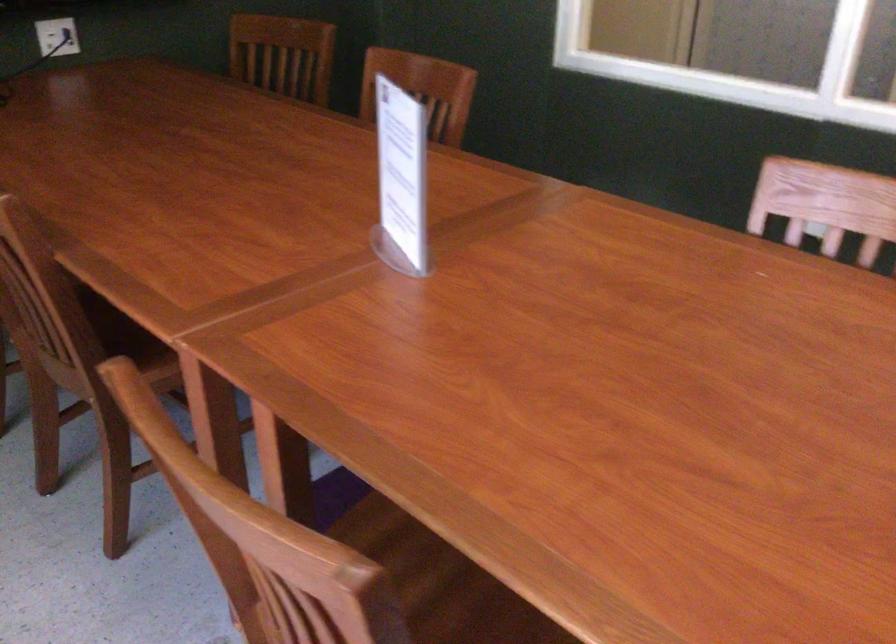
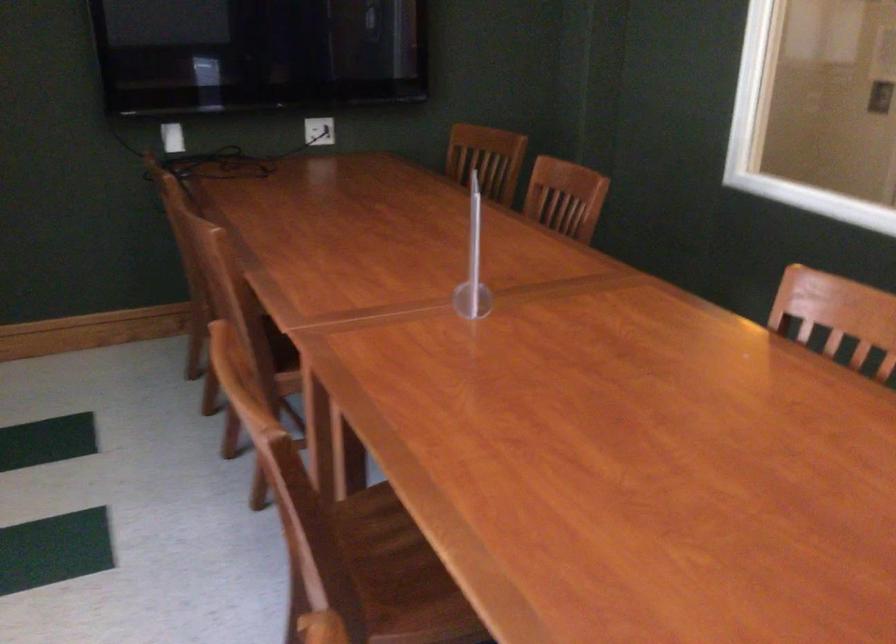
Which direction would the cameraman need to move to produce the second image?

The movement direction of the cameraman is right, backward.